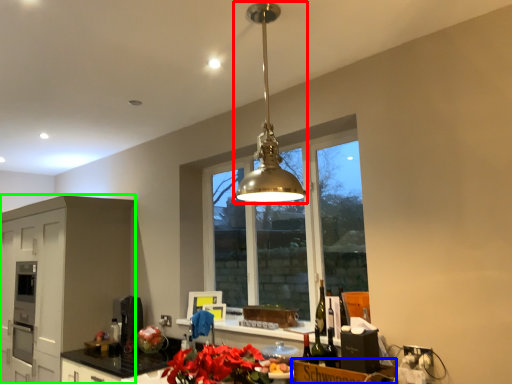
Question: Which is nearer to the light fixture (highlighted by a red box)? cardboard box (highlighted by a blue box) or cabinetry (highlighted by a green box).

Choices:
 (A) cardboard box
 (B) cabinetry

Answer: (A)